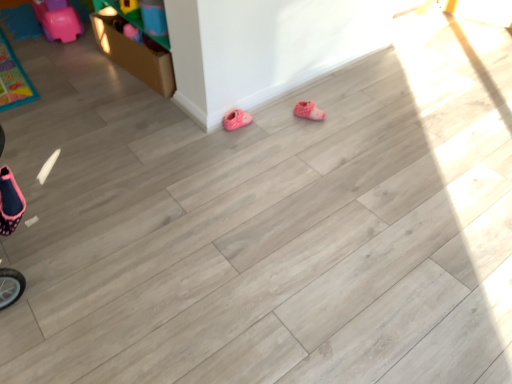
What do you see at coordinates (236, 119) in the screenshot?
I see `pink fabric slipper at lower center, the 1th footwear from the left` at bounding box center [236, 119].

This screenshot has height=384, width=512. I want to click on pink fabric slipper at lower center, the 1th footwear from the left, so click(236, 119).

Describe the element at coordinates (308, 111) in the screenshot. This screenshot has height=384, width=512. I see `pink polka dot fabric booties at center, positioned as the second footwear in left-to-right order` at that location.

Identify the location of pink polka dot fabric booties at center, the first footwear from the right. The height and width of the screenshot is (384, 512). (308, 111).

Where is `pink fabric slipper at lower center, the 1th footwear from the left`? pink fabric slipper at lower center, the 1th footwear from the left is located at coordinates (236, 119).

Is pink polka dot fabric booties at center, the first footwear from the right, to the left or to the right of pink fabric slipper at lower center, which ranks as the second footwear in right-to-left order, in the image?

From the image, it's evident that pink polka dot fabric booties at center, the first footwear from the right, is to the right of pink fabric slipper at lower center, which ranks as the second footwear in right-to-left order.

Which object is closer to the camera, pink polka dot fabric booties at center, the first footwear from the right, or pink fabric slipper at lower center, which ranks as the second footwear in right-to-left order?

Positioned in front is pink fabric slipper at lower center, which ranks as the second footwear in right-to-left order.

Is point (323, 118) behind point (226, 130)?

Yes, it is.

From the image's perspective, which one is positioned lower, pink polka dot fabric booties at center, the first footwear from the right, or pink fabric slipper at lower center, which ranks as the second footwear in right-to-left order?

pink fabric slipper at lower center, which ranks as the second footwear in right-to-left order, from the image's perspective.

From a real-world perspective, which is physically below, pink polka dot fabric booties at center, positioned as the second footwear in left-to-right order, or pink fabric slipper at lower center, the 1th footwear from the left?

From a 3D spatial view, pink fabric slipper at lower center, the 1th footwear from the left, is below.

In terms of width, does pink polka dot fabric booties at center, the first footwear from the right, look wider or thinner when compared to pink fabric slipper at lower center, the 1th footwear from the left?

pink polka dot fabric booties at center, the first footwear from the right, is wider than pink fabric slipper at lower center, the 1th footwear from the left.

Can you confirm if pink polka dot fabric booties at center, positioned as the second footwear in left-to-right order, is shorter than pink fabric slipper at lower center, the 1th footwear from the left?

Correct, pink polka dot fabric booties at center, positioned as the second footwear in left-to-right order, is not as tall as pink fabric slipper at lower center, the 1th footwear from the left.

Is pink polka dot fabric booties at center, positioned as the second footwear in left-to-right order, bigger or smaller than pink fabric slipper at lower center, which ranks as the second footwear in right-to-left order?

pink polka dot fabric booties at center, positioned as the second footwear in left-to-right order, is smaller than pink fabric slipper at lower center, which ranks as the second footwear in right-to-left order.

Is pink polka dot fabric booties at center, positioned as the second footwear in left-to-right order, outside of pink fabric slipper at lower center, which ranks as the second footwear in right-to-left order?

Indeed, pink polka dot fabric booties at center, positioned as the second footwear in left-to-right order, is completely outside pink fabric slipper at lower center, which ranks as the second footwear in right-to-left order.

Does pink polka dot fabric booties at center, the first footwear from the right, touch pink fabric slipper at lower center, the 1th footwear from the left?

No, pink polka dot fabric booties at center, the first footwear from the right, is not next to pink fabric slipper at lower center, the 1th footwear from the left.

Based on the photo, does pink polka dot fabric booties at center, the first footwear from the right, turn towards pink fabric slipper at lower center, which ranks as the second footwear in right-to-left order?

No, pink polka dot fabric booties at center, the first footwear from the right, is not facing towards pink fabric slipper at lower center, which ranks as the second footwear in right-to-left order.

Image resolution: width=512 pixels, height=384 pixels. Find the location of `footwear located above the pink fabric slipper at lower center, the 1th footwear from the left (from a real-world perspective)`. footwear located above the pink fabric slipper at lower center, the 1th footwear from the left (from a real-world perspective) is located at coordinates (308, 111).

From the picture: Is pink fabric slipper at lower center, the 1th footwear from the left, to the left of pink polka dot fabric booties at center, the first footwear from the right, from the viewer's perspective?

Correct, you'll find pink fabric slipper at lower center, the 1th footwear from the left, to the left of pink polka dot fabric booties at center, the first footwear from the right.

Between pink fabric slipper at lower center, the 1th footwear from the left, and pink polka dot fabric booties at center, the first footwear from the right, which one is positioned in front?

pink fabric slipper at lower center, the 1th footwear from the left, is more forward.

Between point (228, 120) and point (305, 115), which one is positioned behind?

Point (305, 115)

Consider the image. From the image's perspective, is pink fabric slipper at lower center, which ranks as the second footwear in right-to-left order, positioned above or below pink polka dot fabric booties at center, the first footwear from the right?

From the image's perspective, pink fabric slipper at lower center, which ranks as the second footwear in right-to-left order, appears below pink polka dot fabric booties at center, the first footwear from the right.

Looking at this image, from a real-world perspective, which is physically above, pink fabric slipper at lower center, the 1th footwear from the left, or pink polka dot fabric booties at center, positioned as the second footwear in left-to-right order?

pink polka dot fabric booties at center, positioned as the second footwear in left-to-right order, from a real-world perspective.

Does pink fabric slipper at lower center, which ranks as the second footwear in right-to-left order, have a lesser width compared to pink polka dot fabric booties at center, the first footwear from the right?

Indeed, pink fabric slipper at lower center, which ranks as the second footwear in right-to-left order, has a lesser width compared to pink polka dot fabric booties at center, the first footwear from the right.

Considering the sizes of pink fabric slipper at lower center, the 1th footwear from the left, and pink polka dot fabric booties at center, positioned as the second footwear in left-to-right order, in the image, is pink fabric slipper at lower center, the 1th footwear from the left, taller or shorter than pink polka dot fabric booties at center, positioned as the second footwear in left-to-right order,?

In the image, pink fabric slipper at lower center, the 1th footwear from the left, appears to be taller than pink polka dot fabric booties at center, positioned as the second footwear in left-to-right order.

Looking at the image, does pink fabric slipper at lower center, the 1th footwear from the left, seem bigger or smaller compared to pink polka dot fabric booties at center, positioned as the second footwear in left-to-right order?

Considering their sizes, pink fabric slipper at lower center, the 1th footwear from the left, takes up more space than pink polka dot fabric booties at center, positioned as the second footwear in left-to-right order.

Is pink fabric slipper at lower center, the 1th footwear from the left, inside or outside of pink polka dot fabric booties at center, the first footwear from the right?

pink fabric slipper at lower center, the 1th footwear from the left, is spatially situated outside pink polka dot fabric booties at center, the first footwear from the right.

Is pink fabric slipper at lower center, the 1th footwear from the left, beside pink polka dot fabric booties at center, positioned as the second footwear in left-to-right order?

No, pink fabric slipper at lower center, the 1th footwear from the left, is not beside pink polka dot fabric booties at center, positioned as the second footwear in left-to-right order.

Is pink polka dot fabric booties at center, positioned as the second footwear in left-to-right order, at the back of pink fabric slipper at lower center, which ranks as the second footwear in right-to-left order?

No.

Looking at this image, how many degrees apart are the facing directions of pink fabric slipper at lower center, which ranks as the second footwear in right-to-left order, and pink polka dot fabric booties at center, the first footwear from the right?

They differ by 39.6 degrees in their facing directions.

Image resolution: width=512 pixels, height=384 pixels. What are the coordinates of `footwear lying on the right of pink fabric slipper at lower center, the 1th footwear from the left` in the screenshot? It's located at (308, 111).

Identify the location of footwear that appears on the right of pink fabric slipper at lower center, which ranks as the second footwear in right-to-left order. The height and width of the screenshot is (384, 512). tap(308, 111).

Where is `footwear above the pink fabric slipper at lower center, the 1th footwear from the left (from the image's perspective)`? This screenshot has width=512, height=384. footwear above the pink fabric slipper at lower center, the 1th footwear from the left (from the image's perspective) is located at coordinates (308, 111).